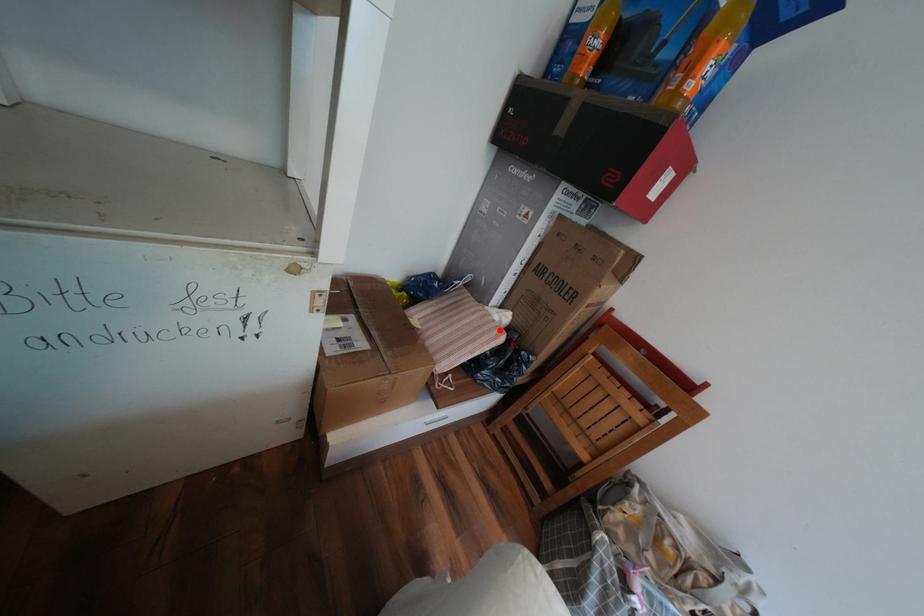
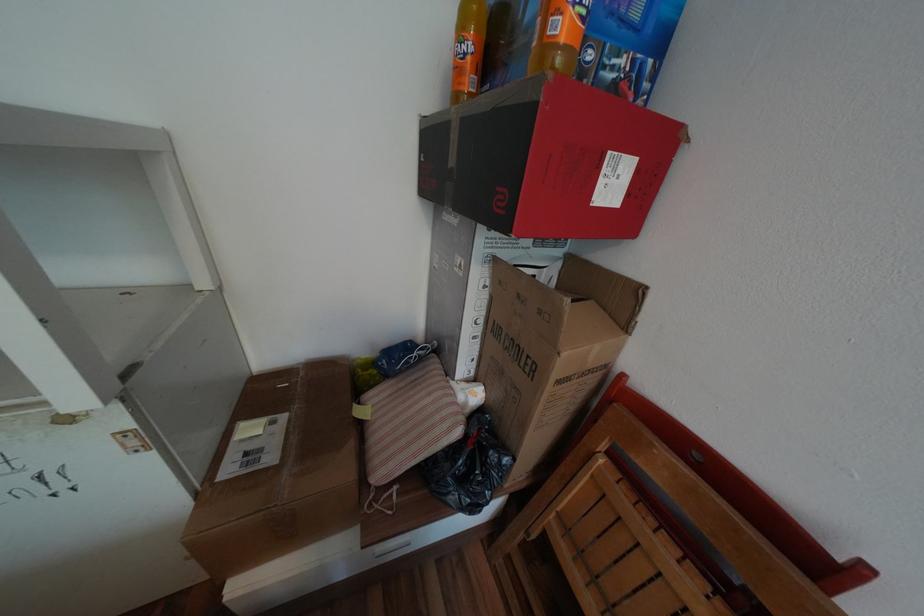
Locate, in the second image, the point that corresponds to the highlighted location in the first image.

(453, 419)